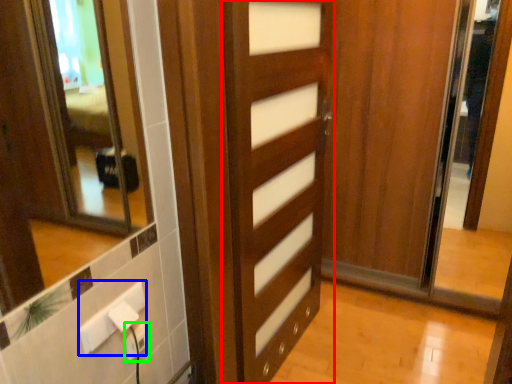
Question: Considering the real-world distances, which object is farthest from door (highlighted by a red box)? electric outlet (highlighted by a blue box) or electric outlet (highlighted by a green box)?

Choices:
 (A) electric outlet
 (B) electric outlet

Answer: (B)